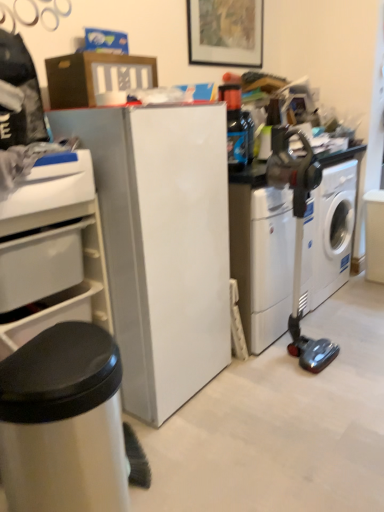
Question: Can you confirm if white plastic drawer at left is wider than white plastic drawer at lower left?

Choices:
 (A) yes
 (B) no

Answer: (A)

Question: Is white plastic drawer at left further to the viewer compared to white plastic drawer at lower left?

Choices:
 (A) yes
 (B) no

Answer: (B)

Question: Is white plastic drawer at left with white plastic drawer at lower left?

Choices:
 (A) yes
 (B) no

Answer: (A)

Question: Does white plastic drawer at left appear on the right side of white plastic drawer at lower left?

Choices:
 (A) no
 (B) yes

Answer: (B)

Question: Could you tell me if white plastic drawer at left is facing white plastic drawer at lower left?

Choices:
 (A) no
 (B) yes

Answer: (B)

Question: Is silver metallic trash can at lower left taller or shorter than metallic gray vacuum cleaner at right?

Choices:
 (A) short
 (B) tall

Answer: (A)

Question: Considering the positions of point (9, 502) and point (311, 155), is point (9, 502) closer or farther from the camera than point (311, 155)?

Choices:
 (A) farther
 (B) closer

Answer: (B)

Question: Looking at their shapes, would you say silver metallic trash can at lower left is wider or thinner than metallic gray vacuum cleaner at right?

Choices:
 (A) wide
 (B) thin

Answer: (A)

Question: Considering their positions, is silver metallic trash can at lower left located in front of or behind metallic gray vacuum cleaner at right?

Choices:
 (A) behind
 (B) front

Answer: (B)

Question: In terms of width, does translucent plastic bottle at upper center look wider or thinner when compared to white plastic washing machine at center-right, placed as the second washing machine when sorted from right to left?

Choices:
 (A) thin
 (B) wide

Answer: (A)

Question: Is translucent plastic bottle at upper center in front of or behind white plastic washing machine at center-right, placed as the second washing machine when sorted from right to left, in the image?

Choices:
 (A) behind
 (B) front

Answer: (B)

Question: Does point (235, 104) appear closer or farther from the camera than point (249, 316)?

Choices:
 (A) farther
 (B) closer

Answer: (B)

Question: From the image's perspective, is translucent plastic bottle at upper center positioned above or below white plastic washing machine at center-right, the first washing machine in the left-to-right sequence?

Choices:
 (A) below
 (B) above

Answer: (B)

Question: In terms of height, does white glossy washing machine at right, marked as the second washing machine in a left-to-right arrangement, look taller or shorter compared to translucent plastic bottle at upper center?

Choices:
 (A) tall
 (B) short

Answer: (A)

Question: In the image, is white glossy washing machine at right, marked as the second washing machine in a left-to-right arrangement, positioned in front of or behind translucent plastic bottle at upper center?

Choices:
 (A) behind
 (B) front

Answer: (A)